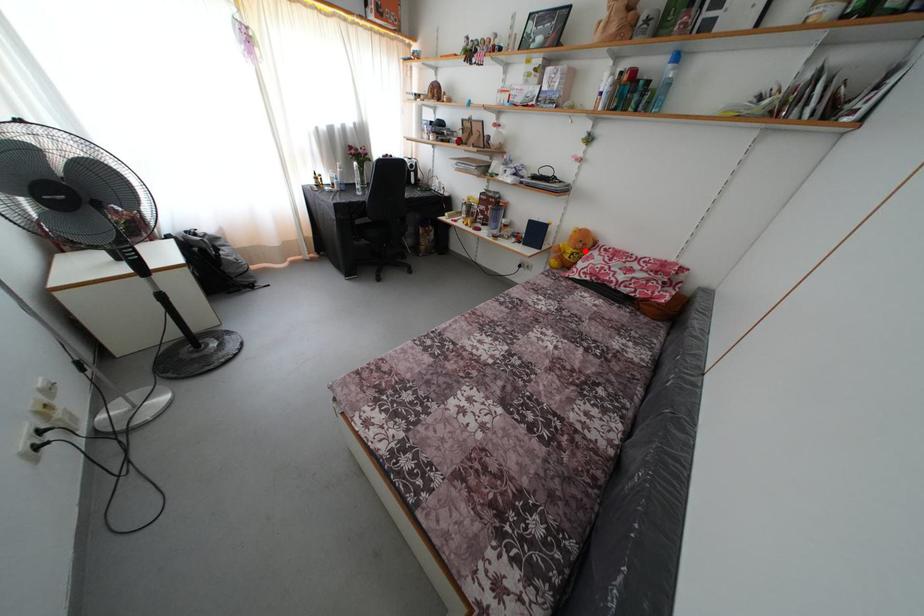
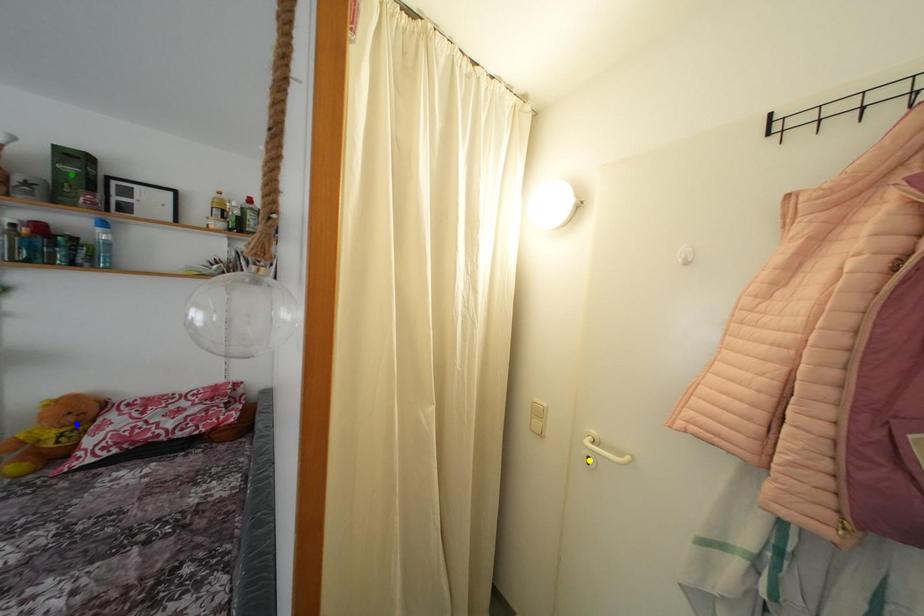
Question: I am providing you with two images of the same scene from different viewpoints. A red point is marked on the first image. You are given multiple points on the second image. Which point in image 2 is actually the same real-world point as the red point in image 1?

Choices:
 (A) green point
 (B) yellow point
 (C) blue point

Answer: (C)